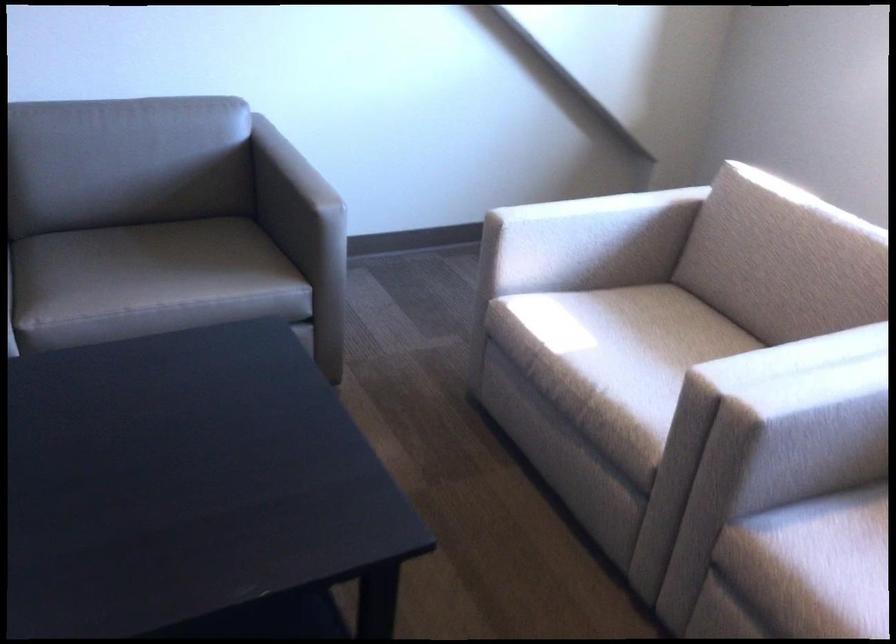
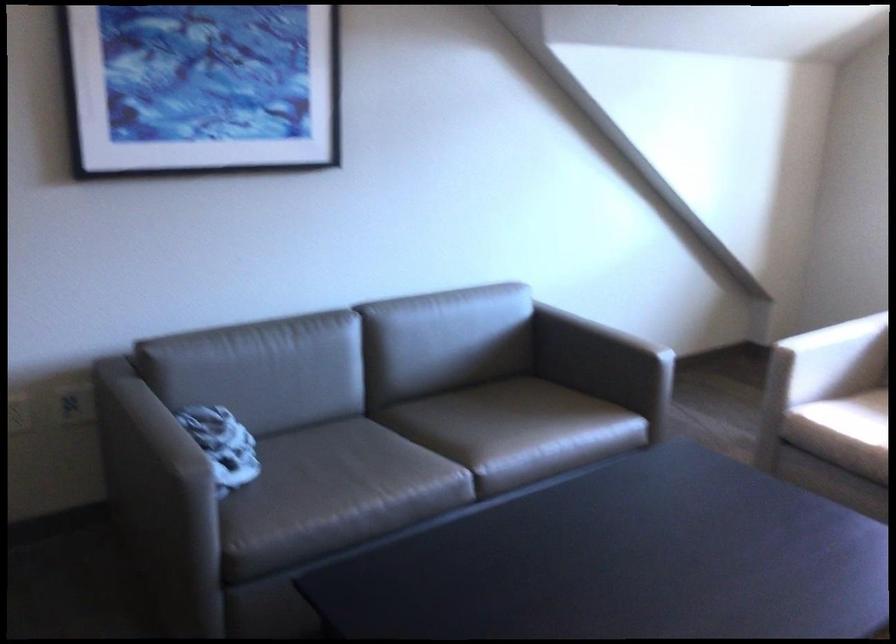
Where in the second image is the point corresponding to pixel 590 242 from the first image?

(831, 359)